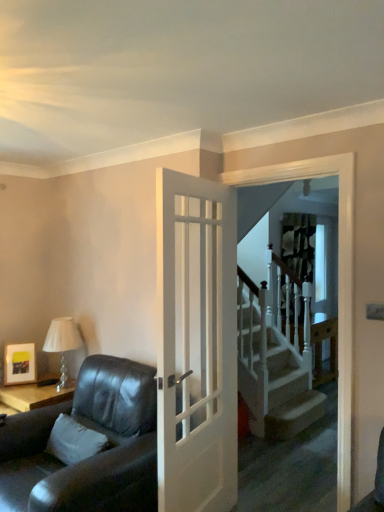
Question: Could you tell me if wooden at right is facing white glossy door at center?

Choices:
 (A) no
 (B) yes

Answer: (A)

Question: From a real-world perspective, does wooden at right stand above white glossy door at center?

Choices:
 (A) no
 (B) yes

Answer: (A)

Question: Is wooden at right positioned in front of white glossy door at center?

Choices:
 (A) yes
 (B) no

Answer: (B)

Question: Considering the relative positions of wooden at right and white glossy door at center in the image provided, is wooden at right to the left of white glossy door at center from the viewer's perspective?

Choices:
 (A) no
 (B) yes

Answer: (A)

Question: Does wooden at right have a greater width compared to white glossy door at center?

Choices:
 (A) yes
 (B) no

Answer: (A)

Question: Considering the relative sizes of wooden at right and white glossy door at center in the image provided, is wooden at right bigger than white glossy door at center?

Choices:
 (A) no
 (B) yes

Answer: (B)

Question: Can you confirm if matte black picture frame at upper left is positioned to the right of patterned fabric curtain at upper center?

Choices:
 (A) yes
 (B) no

Answer: (B)

Question: Is matte black picture frame at upper left not inside patterned fabric curtain at upper center?

Choices:
 (A) yes
 (B) no

Answer: (A)

Question: From a real-world perspective, is matte black picture frame at upper left under patterned fabric curtain at upper center?

Choices:
 (A) no
 (B) yes

Answer: (B)

Question: Does matte black picture frame at upper left appear on the left side of patterned fabric curtain at upper center?

Choices:
 (A) no
 (B) yes

Answer: (B)

Question: From a real-world perspective, is matte black picture frame at upper left on patterned fabric curtain at upper center?

Choices:
 (A) yes
 (B) no

Answer: (B)

Question: Is matte black picture frame at upper left taller than patterned fabric curtain at upper center?

Choices:
 (A) no
 (B) yes

Answer: (A)

Question: Considering the relative positions of matte black picture frame at upper left and white glossy screen door at upper center in the image provided, is matte black picture frame at upper left behind white glossy screen door at upper center?

Choices:
 (A) no
 (B) yes

Answer: (B)